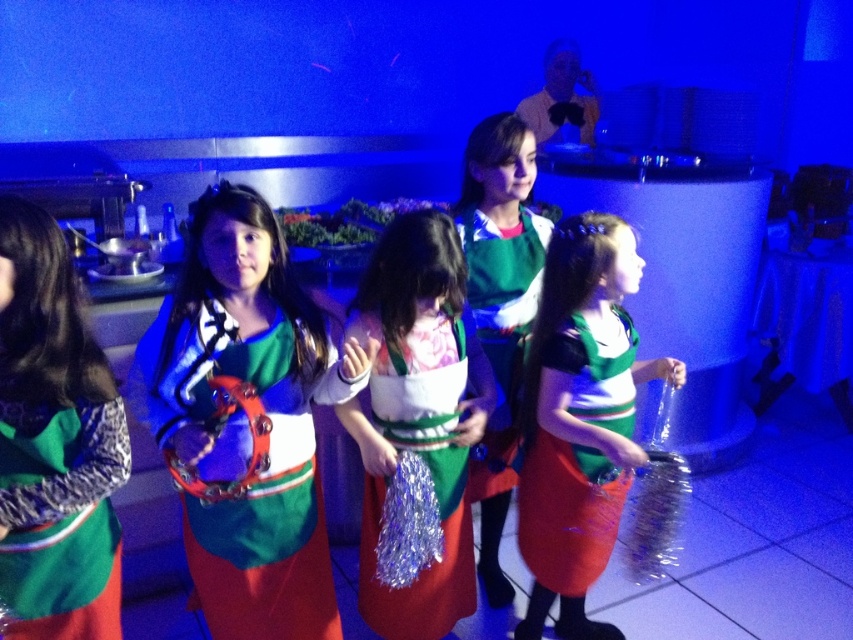
Please provide the 2D coordinates of the matte plastic tambourine at center in the image. The coordinates should be in the format of a point with two decimal places separated by a comma, like 0.500,0.500. The scene shows children in festive attire on a stage with a buffet setup in the background.

The matte plastic tambourine at center is located at point (254,480).

You are a photographer trying to capture a clear photo of the green matte dress at center without the shiny metallic tambourine at center blocking it. Based on their positions, is it possible to adjust your angle to avoid the tambourine?

The shiny metallic tambourine at center is behind the green matte dress at center, so you can position yourself in front of the green matte dress at center to avoid the tambourine being in the frame.

You are a photographer trying to capture a photo of the green matte dress at center and the green satin skirt at center. Based on their positions, which one should you focus on first if you want to ensure both are in the frame without moving the camera?

The green satin skirt at center should be focused on first since it is above the green matte dress at center. By focusing on the higher object first, you can ensure that both will be within the camera frame without needing to adjust the camera position.